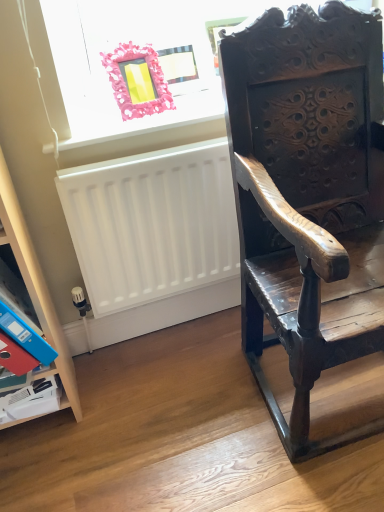
Where is `free space in front of white matte radiator at lower left`? The width and height of the screenshot is (384, 512). free space in front of white matte radiator at lower left is located at coordinates (177, 402).